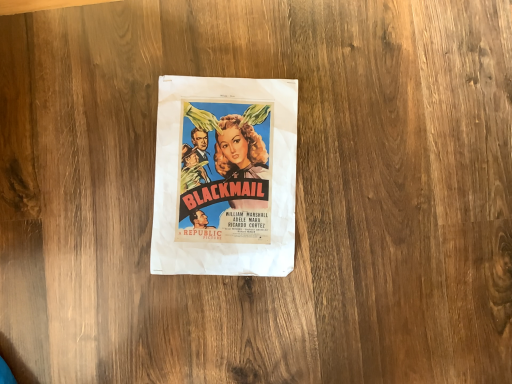
Where is `free space above matte paper poster at center (from a real-world perspective)`? The image size is (512, 384). free space above matte paper poster at center (from a real-world perspective) is located at coordinates (227, 173).